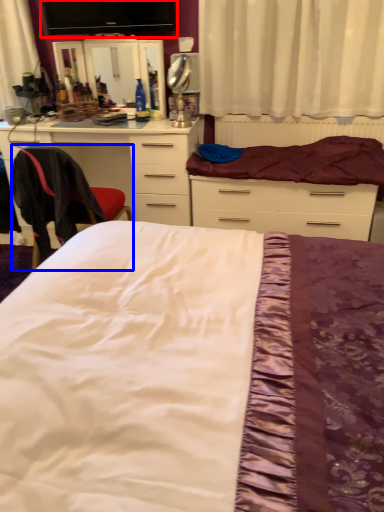
Question: Which object is closer to the camera taking this photo, computer monitor (highlighted by a red box) or chair (highlighted by a blue box)?

Choices:
 (A) computer monitor
 (B) chair

Answer: (B)